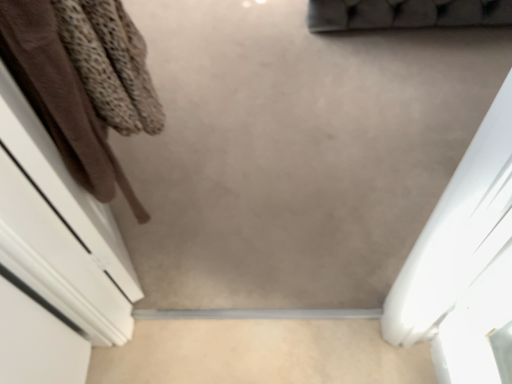
Identify the location of brown fabric at left. The width and height of the screenshot is (512, 384). (61, 98).

Describe the element at coordinates (61, 98) in the screenshot. The image size is (512, 384). I see `brown fabric at left` at that location.

What is the approximate width of brown fabric at left?

It is 0.94 inches.

The height and width of the screenshot is (384, 512). Describe the element at coordinates (260, 353) in the screenshot. I see `beige matte concrete at center` at that location.

What is the approximate height of beige matte concrete at center?

0.39 inches.

In order to click on beige matte concrete at center in this screenshot , I will do [x=260, y=353].

Where is `brown fabric at left`? The height and width of the screenshot is (384, 512). brown fabric at left is located at coordinates (61, 98).

Considering the positions of objects beige matte concrete at center and brown fabric at left in the image provided, who is more to the left, beige matte concrete at center or brown fabric at left?

From the viewer's perspective, brown fabric at left appears more on the left side.

Which is in front, beige matte concrete at center or brown fabric at left?

brown fabric at left.

Does point (87, 377) come in front of point (64, 120)?

No, (87, 377) is behind (64, 120).

From the image's perspective, which is below, beige matte concrete at center or brown fabric at left?

beige matte concrete at center.

From a real-world perspective, is beige matte concrete at center under brown fabric at left?

Correct, in the physical world, beige matte concrete at center is lower than brown fabric at left.

Between beige matte concrete at center and brown fabric at left, which one has larger width?

Wider between the two is beige matte concrete at center.

From their relative heights in the image, would you say beige matte concrete at center is taller or shorter than brown fabric at left?

Clearly, beige matte concrete at center is shorter compared to brown fabric at left.

Consider the image. In terms of size, does beige matte concrete at center appear bigger or smaller than brown fabric at left?

beige matte concrete at center is smaller than brown fabric at left.

Is beige matte concrete at center not inside brown fabric at left?

Yes, beige matte concrete at center is located beyond the bounds of brown fabric at left.

Would you say beige matte concrete at center is a long distance from brown fabric at left?

No, there isn't a large distance between beige matte concrete at center and brown fabric at left.

Is beige matte concrete at center oriented towards brown fabric at left?

No, beige matte concrete at center does not turn towards brown fabric at left.

Where is `concrete behind the brown fabric at left`? concrete behind the brown fabric at left is located at coordinates (260, 353).

Which object is positioned more to the left, brown fabric at left or beige matte concrete at center?

Positioned to the left is brown fabric at left.

Which object is more forward, brown fabric at left or beige matte concrete at center?

brown fabric at left is closer to the camera.

Between point (33, 0) and point (351, 373), which one is positioned in front?

The point (33, 0) is more forward.

From the image's perspective, is brown fabric at left located above or below beige matte concrete at center?

Clearly, from the image's perspective, brown fabric at left is above beige matte concrete at center.

From a real-world perspective, is brown fabric at left positioned under beige matte concrete at center based on gravity?

No.

Which object is thinner, brown fabric at left or beige matte concrete at center?

Thinner between the two is brown fabric at left.

Based on the photo, between brown fabric at left and beige matte concrete at center, which one has less height?

With less height is beige matte concrete at center.

Is brown fabric at left bigger than beige matte concrete at center?

Correct, brown fabric at left is larger in size than beige matte concrete at center.

Which is correct: brown fabric at left is inside beige matte concrete at center, or outside of it?

brown fabric at left is not enclosed by beige matte concrete at center.

Is brown fabric at left not near beige matte concrete at center?

No.

Is beige matte concrete at center at the back of brown fabric at left?

brown fabric at left does not have its back to beige matte concrete at center.

Can you tell me how much brown fabric at left and beige matte concrete at center differ in facing direction?

brown fabric at left and beige matte concrete at center are facing 61.8 degrees away from each other.

At what (x,y) coordinates should I click in order to perform the action: click on clothing in front of the beige matte concrete at center. Please return your answer as a coordinate pair (x, y). Looking at the image, I should click on (61, 98).

At what (x,y) coordinates should I click in order to perform the action: click on concrete lying on the right of brown fabric at left. Please return your answer as a coordinate pair (x, y). This screenshot has width=512, height=384. Looking at the image, I should click on (260, 353).

Where is `concrete located behind the brown fabric at left`? This screenshot has height=384, width=512. concrete located behind the brown fabric at left is located at coordinates (260, 353).